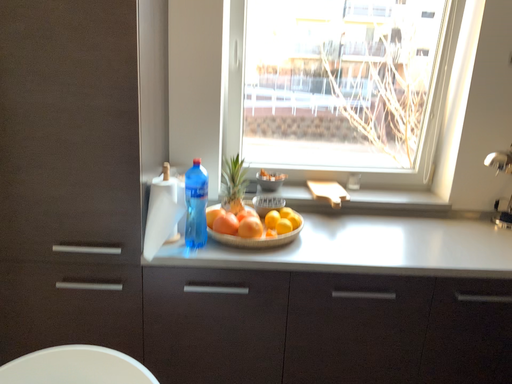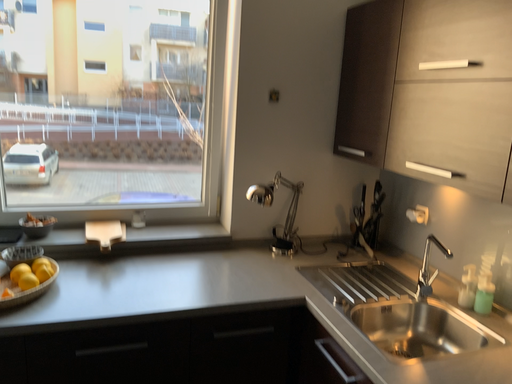
Question: Which way did the camera rotate in the video?

Choices:
 (A) rotated left
 (B) rotated right

Answer: (B)